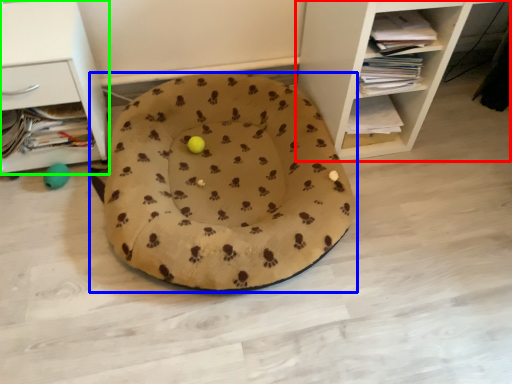
Question: Considering the real-world distances, which object is closest to shelf (highlighted by a red box)? dog bed (highlighted by a blue box) or shelf (highlighted by a green box).

Choices:
 (A) dog bed
 (B) shelf

Answer: (A)